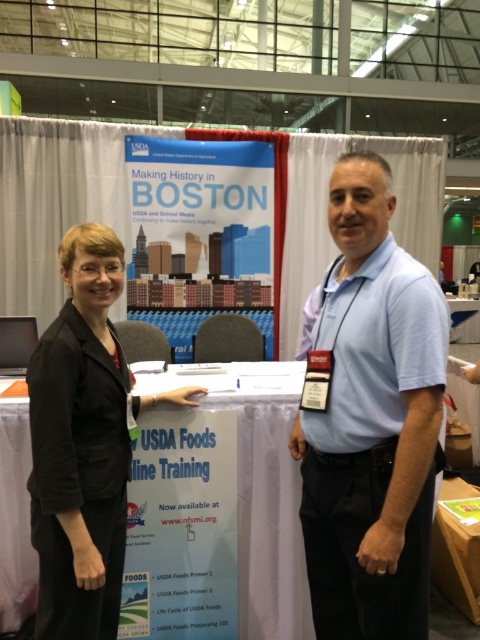
Question: Which object appears farthest from the camera in this image?

Choices:
 (A) black fabric suit at left
 (B) light blue shirt at center

Answer: (A)

Question: Is light blue shirt at center closer to camera compared to black fabric suit at left?

Choices:
 (A) no
 (B) yes

Answer: (B)

Question: Can you confirm if light blue shirt at center is thinner than black fabric suit at left?

Choices:
 (A) yes
 (B) no

Answer: (A)

Question: In this image, where is light blue shirt at center located relative to black fabric suit at left?

Choices:
 (A) right
 (B) left

Answer: (A)